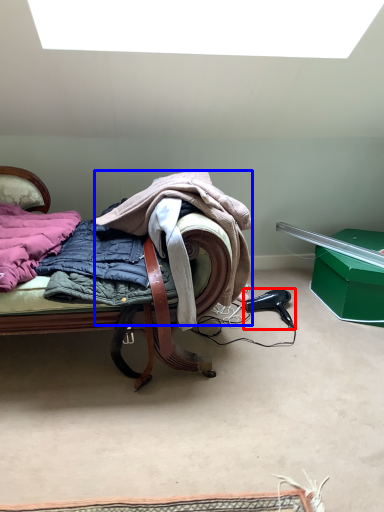
Question: Which object is further to the camera taking this photo, hair drier (highlighted by a red box) or cloak (highlighted by a blue box)?

Choices:
 (A) hair drier
 (B) cloak

Answer: (A)